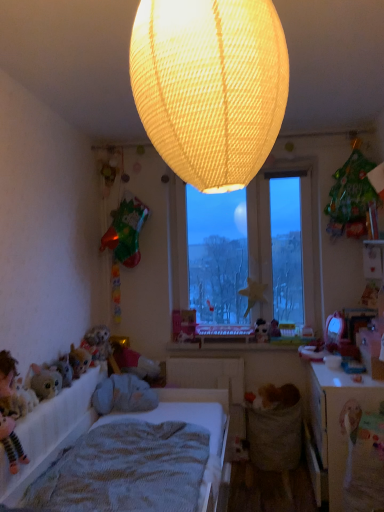
You are a GUI agent. You are given a task and a screenshot of the screen. Output one action in this format:
    pyautogui.click(x=<x>, y=<y>)
    Task: Click on the free location above smooth plastic window sill at center (from a real-world perspective)
    The height and width of the screenshot is (512, 384).
    Given the screenshot: What is the action you would take?
    pyautogui.click(x=251, y=343)